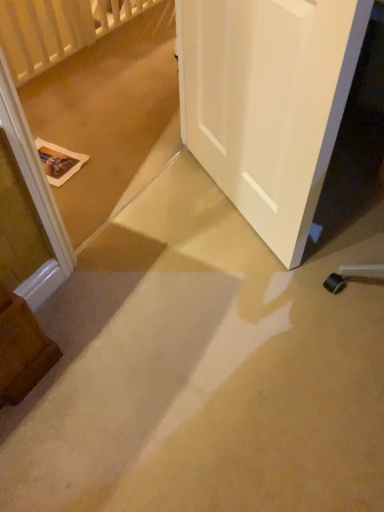
Locate an element on the screen. This screenshot has width=384, height=512. white wooden balustrade at upper left is located at coordinates (57, 29).

Find the location of a particular element. Image resolution: width=384 pixels, height=512 pixels. beige carpet at lower center is located at coordinates (203, 369).

Can you confirm if white wooden balustrade at upper left is positioned to the left of white matte door at center?

Yes, white wooden balustrade at upper left is to the left of white matte door at center.

In the scene shown: Would you consider white wooden balustrade at upper left to be distant from white matte door at center?

white wooden balustrade at upper left is positioned a significant distance from white matte door at center.

Relative to white matte door at center, is white wooden balustrade at upper left in front or behind?

white wooden balustrade at upper left is positioned farther from the viewer than white matte door at center.

In terms of width, does white wooden balustrade at upper left look wider or thinner when compared to white matte door at center?

In the image, white wooden balustrade at upper left appears to be wider than white matte door at center.

Based on the photo, can you tell me how much white matte door at center and beige carpet at lower center differ in facing direction?

There is a 149-degree angle between the facing directions of white matte door at center and beige carpet at lower center.

Does white matte door at center have a greater height compared to beige carpet at lower center?

Yes, white matte door at center is taller than beige carpet at lower center.

Is white matte door at center bigger or smaller than beige carpet at lower center?

In the image, white matte door at center appears to be smaller than beige carpet at lower center.

I want to click on concrete in front of the white matte door at center, so click(203, 369).

From a real-world perspective, is beige carpet at lower center under white matte door at center?

Yes, from a real-world perspective, beige carpet at lower center is under white matte door at center.

Is beige carpet at lower center facing away from white matte door at center?

beige carpet at lower center is not turned away from white matte door at center.

Based on their positions, is beige carpet at lower center located to the left or right of white matte door at center?

Based on their positions, beige carpet at lower center is located to the right of white matte door at center.

Does point (298, 314) appear closer or farther from the camera than point (203, 23)?

Point (298, 314) is closer to the camera than point (203, 23).

From a real-world perspective, is white matte door at center above or below white wooden balustrade at upper left?

In terms of real-world spatial position, white matte door at center is above white wooden balustrade at upper left.

Which is in front, white matte door at center or white wooden balustrade at upper left?

white matte door at center.

Which object is positioned more to the right, white matte door at center or white wooden balustrade at upper left?

white matte door at center is more to the right.

Is white matte door at center oriented away from white wooden balustrade at upper left?

That's not correct — white matte door at center is not looking away from white wooden balustrade at upper left.

How far apart are white wooden balustrade at upper left and beige carpet at lower center?

white wooden balustrade at upper left is 1.76 meters away from beige carpet at lower center.

Considering their positions, is white wooden balustrade at upper left located in front of or behind beige carpet at lower center?

Clearly, white wooden balustrade at upper left is behind beige carpet at lower center.

Is the surface of white wooden balustrade at upper left in direct contact with beige carpet at lower center?

white wooden balustrade at upper left and beige carpet at lower center are clearly separated.

Is white wooden balustrade at upper left inside or outside of beige carpet at lower center?

The correct answer is: outside.

Considering the points (165, 484) and (0, 26), which point is in front, point (165, 484) or point (0, 26)?

Point (165, 484)

Is beige carpet at lower center far from white wooden balustrade at upper left?

Indeed, beige carpet at lower center is not near white wooden balustrade at upper left.

Locate an element on the screen. The width and height of the screenshot is (384, 512). balustrade above the beige carpet at lower center (from the image's perspective) is located at coordinates (57, 29).

Locate an element on the screen. balustrade located on the left of white matte door at center is located at coordinates (57, 29).

Where is `concrete located below the white matte door at center (from the image's perspective)`? Image resolution: width=384 pixels, height=512 pixels. concrete located below the white matte door at center (from the image's perspective) is located at coordinates (203, 369).

Which object lies further to the anchor point beige carpet at lower center, white matte door at center or white wooden balustrade at upper left?

white wooden balustrade at upper left is further to beige carpet at lower center.

Looking at the image, which one is located closer to beige carpet at lower center, white wooden balustrade at upper left or white matte door at center?

The object closer to beige carpet at lower center is white matte door at center.

Considering their positions, is beige carpet at lower center positioned closer to white matte door at center than white wooden balustrade at upper left?

beige carpet at lower center.

Based on their spatial positions, is white matte door at center or beige carpet at lower center closer to white wooden balustrade at upper left?

The object closer to white wooden balustrade at upper left is white matte door at center.

From the image, which object appears to be nearer to white matte door at center, white wooden balustrade at upper left or beige carpet at lower center?

The object closer to white matte door at center is beige carpet at lower center.

Which object lies nearer to the anchor point white wooden balustrade at upper left, beige carpet at lower center or white matte door at center?

white matte door at center.

The width and height of the screenshot is (384, 512). Find the location of `door between white wooden balustrade at upper left and beige carpet at lower center in the vertical direction`. door between white wooden balustrade at upper left and beige carpet at lower center in the vertical direction is located at coordinates (268, 102).